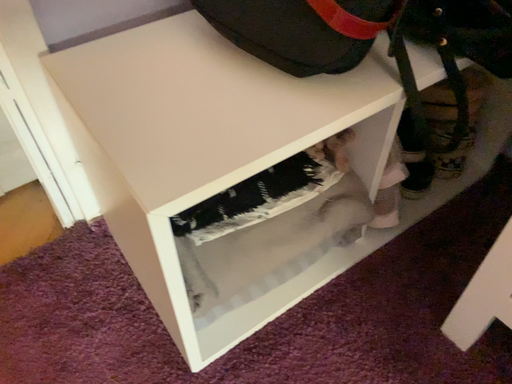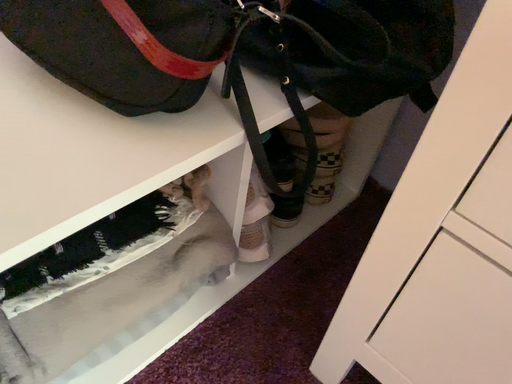
Question: Which way did the camera rotate in the video?

Choices:
 (A) rotated left
 (B) rotated right

Answer: (B)